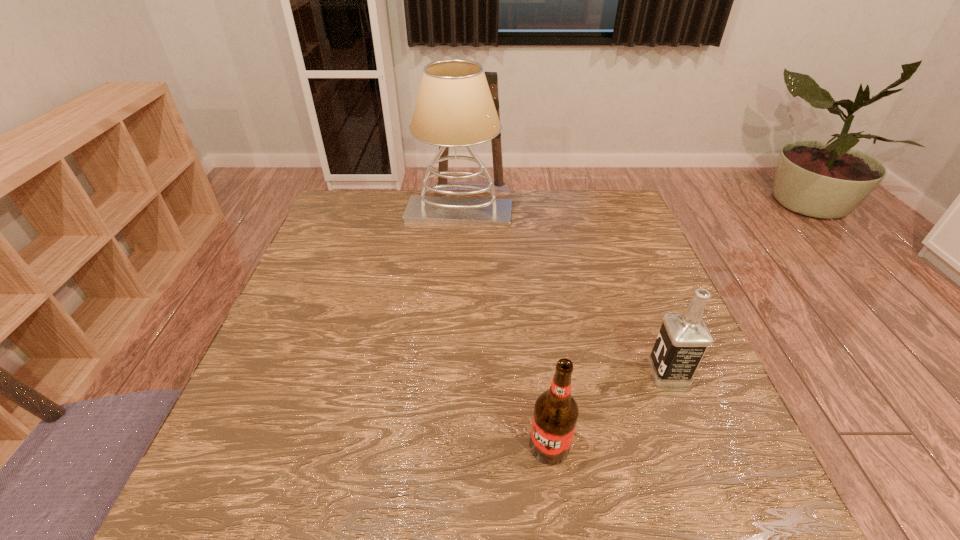
Image resolution: width=960 pixels, height=540 pixels. I want to click on free region that satisfies the following two spatial constraints: 1. on the front label of the vodka; 2. on the front side of the nearest object, so click(x=697, y=446).

Locate an element on the screen. This screenshot has height=540, width=960. vacant space that satisfies the following two spatial constraints: 1. on the front label of the vodka; 2. on the front side of the nearest object is located at coordinates (697, 446).

At what (x,y) coordinates should I click in order to perform the action: click on vacant space that satisfies the following two spatial constraints: 1. on the front side of the nearest object; 2. on the right side of the tallest object. Please return your answer as a coordinate pair (x, y). Looking at the image, I should click on (444, 446).